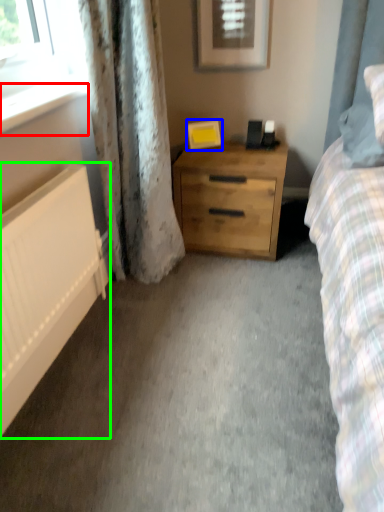
Question: Which object is the closest to the window sill (highlighted by a red box)? Choose among these: picture frame (highlighted by a blue box) or radiator (highlighted by a green box).

Choices:
 (A) picture frame
 (B) radiator

Answer: (B)